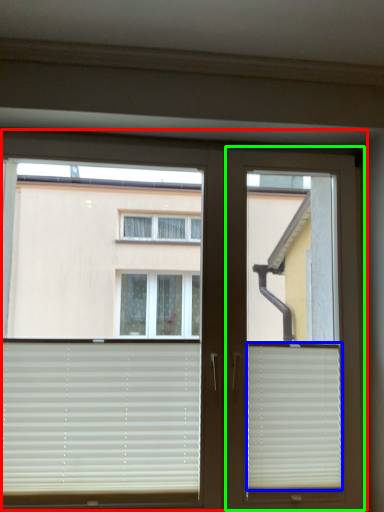
Question: Considering the real-world distances, which object is farthest from window (highlighted by a red box)? window blind (highlighted by a blue box) or screen door (highlighted by a green box)?

Choices:
 (A) window blind
 (B) screen door

Answer: (A)